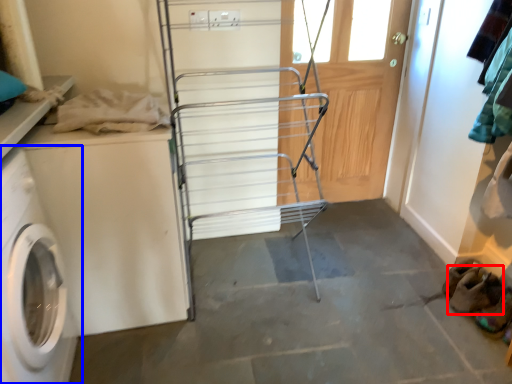
Question: Which object is closer to the camera taking this photo, shoe (highlighted by a red box) or washing machine (highlighted by a blue box)?

Choices:
 (A) shoe
 (B) washing machine

Answer: (B)